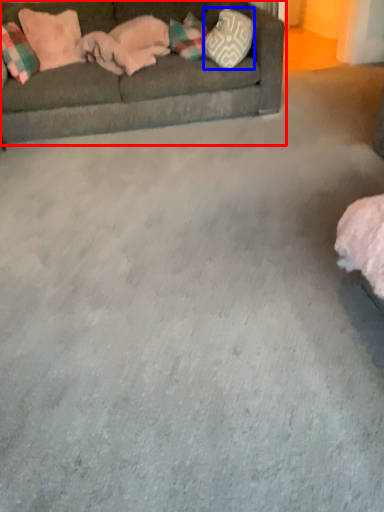
Question: Which object is further to the camera taking this photo, studio couch (highlighted by a red box) or pillow (highlighted by a blue box)?

Choices:
 (A) studio couch
 (B) pillow

Answer: (B)